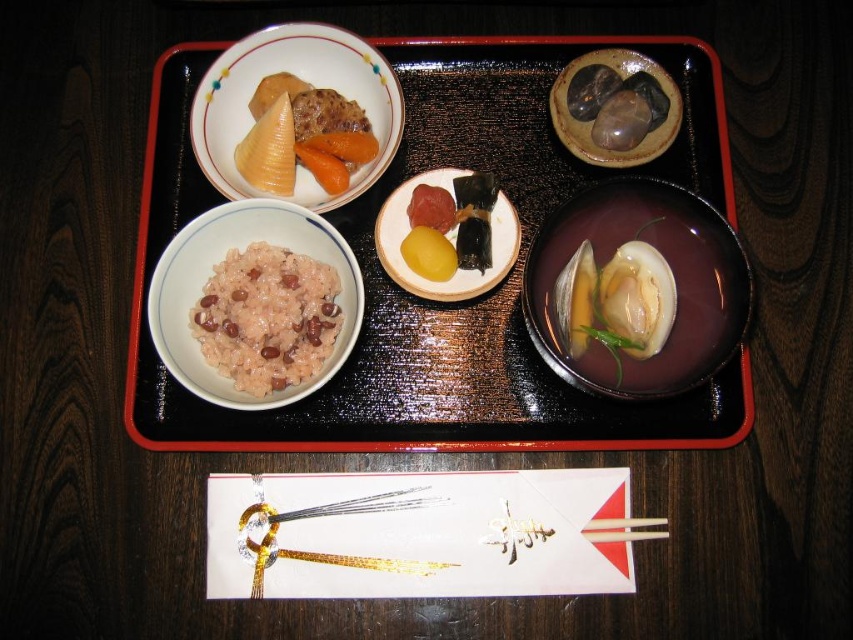
Can you confirm if matte brown rice at upper left is positioned above smooth yellow rice cake at center?

Correct, matte brown rice at upper left is located above smooth yellow rice cake at center.

The height and width of the screenshot is (640, 853). Identify the location of matte brown rice at upper left. (302, 136).

Can you confirm if black glossy tray at center is wider than matte brown bowl at upper right?

Yes, black glossy tray at center is wider than matte brown bowl at upper right.

Who is shorter, black glossy tray at center or matte brown bowl at upper right?

With less height is matte brown bowl at upper right.

Identify the location of black glossy tray at center. Image resolution: width=853 pixels, height=640 pixels. (431, 300).

Where is `black glossy tray at center`? The image size is (853, 640). black glossy tray at center is located at coordinates (431, 300).

Can you confirm if glossy ceramic bowl at center right is smaller than matte brown bowl at upper right?

Incorrect, glossy ceramic bowl at center right is not smaller in size than matte brown bowl at upper right.

Is glossy ceramic bowl at center right to the left of matte brown bowl at upper right from the viewer's perspective?

Indeed, glossy ceramic bowl at center right is positioned on the left side of matte brown bowl at upper right.

What do you see at coordinates (672, 275) in the screenshot? I see `glossy ceramic bowl at center right` at bounding box center [672, 275].

The width and height of the screenshot is (853, 640). Identify the location of glossy ceramic bowl at center right. (672, 275).